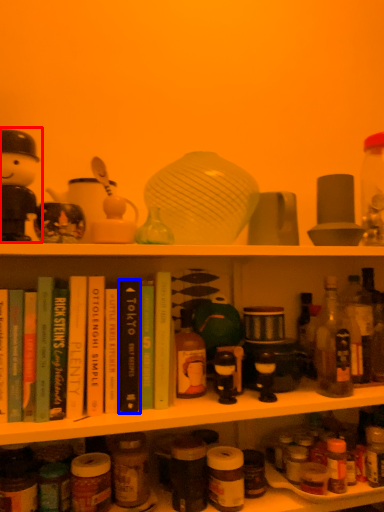
Question: Which object is further to the camera taking this photo, toy (highlighted by a red box) or book (highlighted by a blue box)?

Choices:
 (A) toy
 (B) book

Answer: (B)